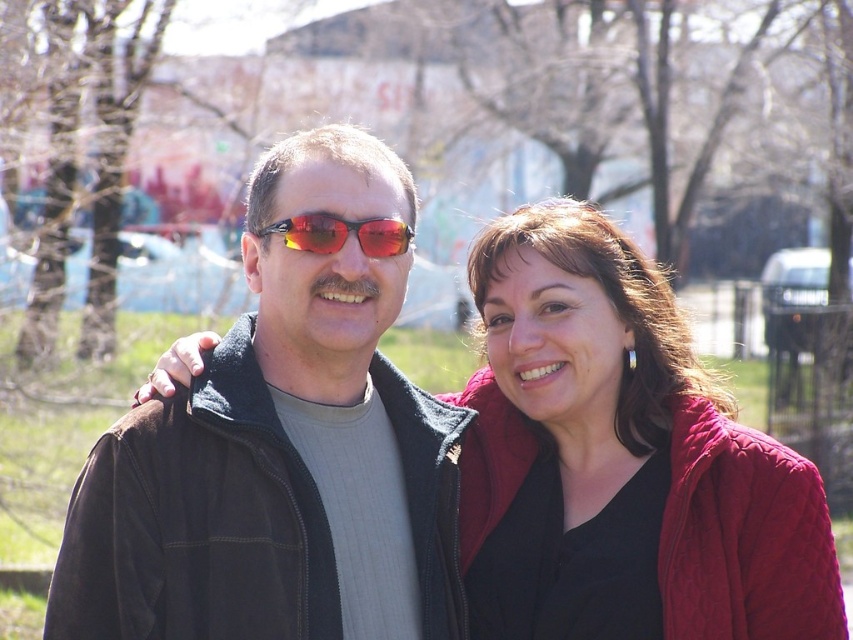
From the picture: You are a photographer trying to capture a closeup shot of the shiny red plastic sunglasses at center. You have a lens that can focus on objects up to 1 meter away. If you are standing 1.2 meters away from the matte black jacket at center, will your lens be able to focus on the sunglasses?

The matte black jacket at center has a larger size compared to shiny red plastic sunglasses at center. Since you are 1.2 meters away from the jacket, the sunglasses are also within that distance. The lens can focus up to 1 meter, so if the sunglasses are closer than 1 meter, it might not work. However, the description only states their sizes, not exact distances. Without knowing the exact distance between you and the sunglasses, we can only assume they are at the same distance as the jacket. Thus, the lens,

You are a photographer adjusting your camera settings to capture the two subjects in the park. The quilted red jacket at center and the shiny red plastic sunglasses at center are both important elements. Given that your camera has a depth of field that can sharply focus on objects within a 1.5 meters range, will both elements be in focus at the same time?

The quilted red jacket at center is 1.56 meters from the shiny red plastic sunglasses at center. Since the distance between them exceeds the camera lens depth of field range of 1.5 meters, they cannot both be in focus simultaneously.

You are a photographer trying to capture a closeup of the shiny red plastic sunglasses at center without including the matte black jacket at center in the frame. Given their positions, do you think this is possible?

The matte black jacket at center is wider than the shiny red plastic sunglasses at center, so it might block the view. It might be challenging to capture the sunglasses without including the jacket in the frame.